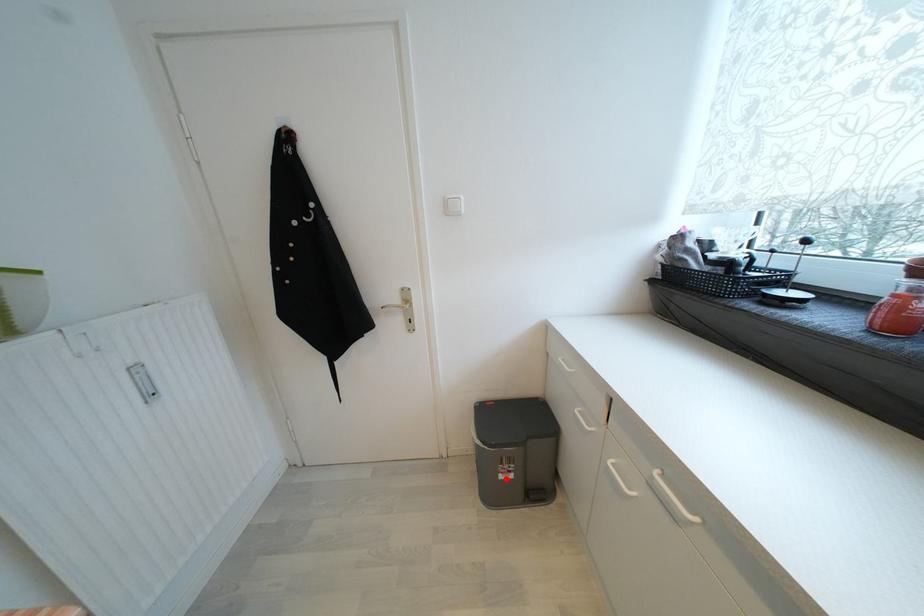
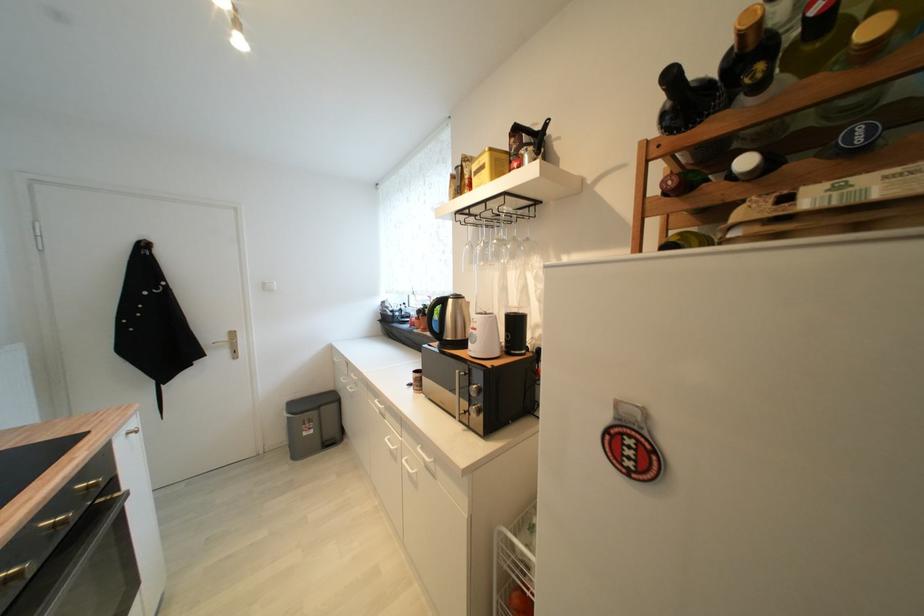
Question: A red point is marked in image1. In image2, is the corresponding 3D point closer to the camera or farther? Reply with the corresponding letter.

Choices:
 (A) The corresponding 3D point is closer.
 (B) The corresponding 3D point is farther.

Answer: (B)